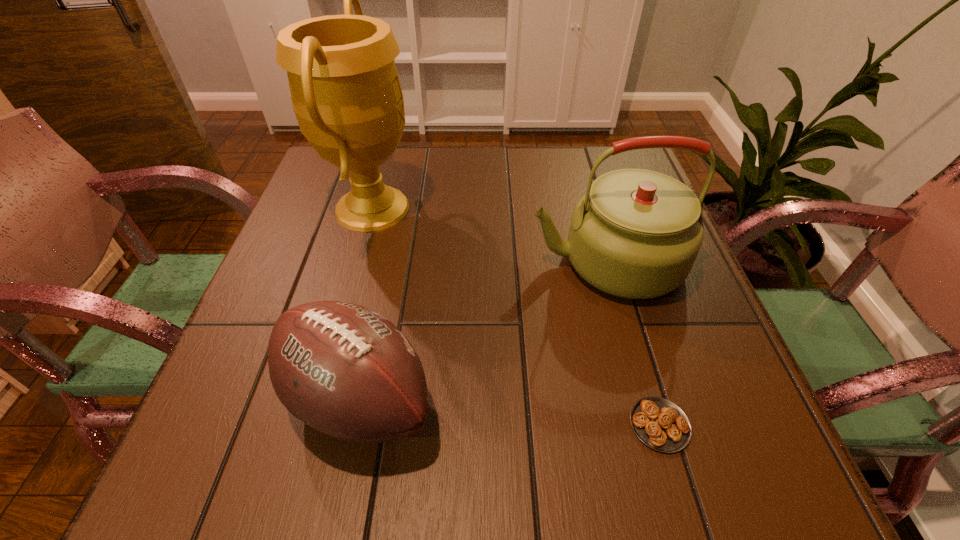
At what (x,y) coordinates should I click in order to perform the action: click on free space that satisfies the following two spatial constraints: 1. on the engravings side of the tallest object; 2. on the left side of the shortest object. Please return your answer as a coordinate pair (x, y). The image size is (960, 540). Looking at the image, I should click on (312, 425).

Find the location of a particular element. vacant space that satisfies the following two spatial constraints: 1. on the engravings side of the second shortest object; 2. on the right side of the tallest object is located at coordinates (319, 400).

You are a GUI agent. You are given a task and a screenshot of the screen. Output one action in this format:
    pyautogui.click(x=<x>, y=<y>)
    Task: Click on the free space that satisfies the following two spatial constraints: 1. at the spout of the shortest object; 2. on the left side of the kettle
    This screenshot has height=540, width=960.
    Given the screenshot: What is the action you would take?
    pyautogui.click(x=653, y=425)

You are a GUI agent. You are given a task and a screenshot of the screen. Output one action in this format:
    pyautogui.click(x=<x>, y=<y>)
    Task: Click on the vacant position in the image that satisfies the following two spatial constraints: 1. at the spout of the kettle; 2. on the right side of the shortest object
    The height and width of the screenshot is (540, 960).
    Given the screenshot: What is the action you would take?
    pyautogui.click(x=653, y=425)

Identify the location of free space that satisfies the following two spatial constraints: 1. at the spout of the second tallest object; 2. on the right side of the pastry. (653, 425).

This screenshot has width=960, height=540. I want to click on vacant space that satisfies the following two spatial constraints: 1. at the spout of the kettle; 2. on the right side of the pastry, so click(653, 425).

This screenshot has width=960, height=540. Find the location of `free point that satisfies the following two spatial constraints: 1. on the engravings side of the pastry; 2. on the left side of the tallest object`. free point that satisfies the following two spatial constraints: 1. on the engravings side of the pastry; 2. on the left side of the tallest object is located at coordinates click(312, 425).